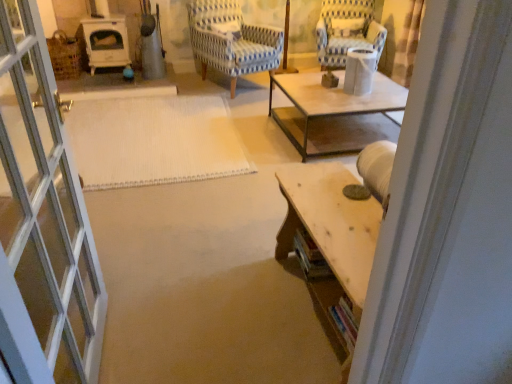
The image size is (512, 384). What are the coordinates of `white woven mat at center` in the screenshot? It's located at (154, 141).

Find the location of `blue and white striped fabric chair at upper right, the first chair from the right`. blue and white striped fabric chair at upper right, the first chair from the right is located at coordinates (347, 31).

The image size is (512, 384). Describe the element at coordinates (331, 222) in the screenshot. I see `wooden table at lower right` at that location.

You are a GUI agent. You are given a task and a screenshot of the screen. Output one action in this format:
    pyautogui.click(x=<x>, y=<y>)
    Task: Click on the white woven mat at center
    This screenshot has width=512, height=384.
    Given the screenshot: What is the action you would take?
    pyautogui.click(x=154, y=141)

Is wooden table at lower right touching blue and white striped fabric chair at upper right, the 2th chair when ordered from left to right?

wooden table at lower right is not next to blue and white striped fabric chair at upper right, the 2th chair when ordered from left to right, and they're not touching.

Between wooden table at lower right and blue and white striped fabric chair at upper right, the 2th chair when ordered from left to right, which one has smaller width?

wooden table at lower right.

What's the angular difference between wooden table at lower right and blue and white striped fabric chair at upper right, the first chair from the right,'s facing directions?

They differ by 67.4 degrees in their facing directions.

Is blue and white striped fabric chair at upper right, the first chair from the right, at the back of wooden table at lower right?

That's not correct — wooden table at lower right is not looking away from blue and white striped fabric chair at upper right, the first chair from the right.

Can you confirm if white woven mat at center is bigger than blue striped fabric chair at center, acting as the 2th chair starting from the right?

No, white woven mat at center is not bigger than blue striped fabric chair at center, acting as the 2th chair starting from the right.

Which is more to the right, white woven mat at center or blue striped fabric chair at center, acting as the 2th chair starting from the right?

From the viewer's perspective, blue striped fabric chair at center, acting as the 2th chair starting from the right, appears more on the right side.

In order to click on mat located below the blue striped fabric chair at center, which ranks as the first chair in left-to-right order (from the image's perspective) in this screenshot , I will do `click(154, 141)`.

Which object is thinner, white woven mat at center or blue striped fabric chair at center, which ranks as the first chair in left-to-right order?

Thinner between the two is blue striped fabric chair at center, which ranks as the first chair in left-to-right order.

Is the position of blue and white striped fabric chair at upper right, the first chair from the right, more distant than that of white woven mat at center?

Yes, blue and white striped fabric chair at upper right, the first chair from the right, is further from the viewer.

Considering the relative sizes of blue and white striped fabric chair at upper right, the first chair from the right, and white woven mat at center in the image provided, is blue and white striped fabric chair at upper right, the first chair from the right, thinner than white woven mat at center?

Indeed, blue and white striped fabric chair at upper right, the first chair from the right, has a lesser width compared to white woven mat at center.

Is blue and white striped fabric chair at upper right, the 2th chair when ordered from left to right, oriented away from white woven mat at center?

No, blue and white striped fabric chair at upper right, the 2th chair when ordered from left to right, is not facing away from white woven mat at center.

How many degrees apart are the facing directions of wooden table at lower right and blue striped fabric chair at center, acting as the 2th chair starting from the right?

There is a 109-degree angle between the facing directions of wooden table at lower right and blue striped fabric chair at center, acting as the 2th chair starting from the right.

Between wooden table at lower right and blue striped fabric chair at center, acting as the 2th chair starting from the right, which one has larger width?

Wider between the two is blue striped fabric chair at center, acting as the 2th chair starting from the right.

Can you confirm if wooden table at lower right is positioned to the left of blue striped fabric chair at center, which ranks as the first chair in left-to-right order?

No.

Which object is more forward, blue and white striped fabric chair at upper right, the 2th chair when ordered from left to right, or wooden table at lower right?

wooden table at lower right.

In the scene shown: Which point is more forward, (359,19) or (341,216)?

The point (341,216) is closer to the camera.

Is blue and white striped fabric chair at upper right, the first chair from the right, aimed at wooden table at lower right?

Yes, blue and white striped fabric chair at upper right, the first chair from the right, is facing wooden table at lower right.

Does blue and white striped fabric chair at upper right, the first chair from the right, have a lesser width compared to blue striped fabric chair at center, which ranks as the first chair in left-to-right order?

Yes, blue and white striped fabric chair at upper right, the first chair from the right, is thinner than blue striped fabric chair at center, which ranks as the first chair in left-to-right order.

From the image's perspective, is blue and white striped fabric chair at upper right, the first chair from the right, positioned above or below blue striped fabric chair at center, which ranks as the first chair in left-to-right order?

Based on their image positions, blue and white striped fabric chair at upper right, the first chair from the right, is located above blue striped fabric chair at center, which ranks as the first chair in left-to-right order.

Is blue and white striped fabric chair at upper right, the first chair from the right, facing away from blue striped fabric chair at center, acting as the 2th chair starting from the right?

No, blue and white striped fabric chair at upper right, the first chair from the right, is not facing away from blue striped fabric chair at center, acting as the 2th chair starting from the right.

In order to click on chair above the blue striped fabric chair at center, acting as the 2th chair starting from the right (from the image's perspective) in this screenshot , I will do `click(347, 31)`.

Is white woven mat at center to the left of wooden table at lower right from the viewer's perspective?

Yes.

From the image's perspective, which is above, white woven mat at center or wooden table at lower right?

white woven mat at center, from the image's perspective.

Relative to wooden table at lower right, is white woven mat at center in front or behind?

In the image, white woven mat at center appears behind wooden table at lower right.

Identify the location of table directly beneath the blue and white striped fabric chair at upper right, the first chair from the right (from a real-world perspective). This screenshot has width=512, height=384. (331, 222).

Locate an element on the screen. The image size is (512, 384). mat that is on the left side of blue striped fabric chair at center, which ranks as the first chair in left-to-right order is located at coordinates (154, 141).

Estimate the real-world distances between objects in this image. Which object is further from blue and white striped fabric chair at upper right, the first chair from the right, wooden table at lower right or blue striped fabric chair at center, acting as the 2th chair starting from the right?

wooden table at lower right is positioned further to the anchor blue and white striped fabric chair at upper right, the first chair from the right.

Estimate the real-world distances between objects in this image. Which object is closer to white woven mat at center, wooden table at lower right or blue and white striped fabric chair at upper right, the first chair from the right?

Based on the image, wooden table at lower right appears to be nearer to white woven mat at center.

Based on the photo, which object lies further to the anchor point white woven mat at center, blue and white striped fabric chair at upper right, the first chair from the right, or blue striped fabric chair at center, which ranks as the first chair in left-to-right order?

Based on the image, blue and white striped fabric chair at upper right, the first chair from the right, appears to be further to white woven mat at center.

Which object lies further to the anchor point wooden table at lower right, white woven mat at center or blue striped fabric chair at center, acting as the 2th chair starting from the right?

blue striped fabric chair at center, acting as the 2th chair starting from the right.

From the image, which object appears to be farther from blue striped fabric chair at center, acting as the 2th chair starting from the right, blue and white striped fabric chair at upper right, the 2th chair when ordered from left to right, or white woven mat at center?

white woven mat at center lies further to blue striped fabric chair at center, acting as the 2th chair starting from the right, than the other object.

Which object lies further to the anchor point blue striped fabric chair at center, which ranks as the first chair in left-to-right order, white woven mat at center or blue and white striped fabric chair at upper right, the first chair from the right?

white woven mat at center lies further to blue striped fabric chair at center, which ranks as the first chair in left-to-right order, than the other object.

Based on their spatial positions, is white woven mat at center or blue striped fabric chair at center, which ranks as the first chair in left-to-right order, closer to blue and white striped fabric chair at upper right, the first chair from the right?

blue striped fabric chair at center, which ranks as the first chair in left-to-right order.

Considering their positions, is wooden table at lower right positioned closer to blue striped fabric chair at center, acting as the 2th chair starting from the right, than blue and white striped fabric chair at upper right, the 2th chair when ordered from left to right?

Based on the image, blue and white striped fabric chair at upper right, the 2th chair when ordered from left to right, appears to be nearer to blue striped fabric chair at center, acting as the 2th chair starting from the right.

Identify the location of mat between wooden table at lower right and blue and white striped fabric chair at upper right, the first chair from the right, from front to back. This screenshot has height=384, width=512. (154, 141).

The width and height of the screenshot is (512, 384). Identify the location of mat between wooden table at lower right and blue striped fabric chair at center, acting as the 2th chair starting from the right, along the z-axis. (154, 141).

Where is `chair located between white woven mat at center and blue and white striped fabric chair at upper right, the 2th chair when ordered from left to right, in the left-right direction`? The height and width of the screenshot is (384, 512). chair located between white woven mat at center and blue and white striped fabric chair at upper right, the 2th chair when ordered from left to right, in the left-right direction is located at coordinates (232, 41).

This screenshot has height=384, width=512. I want to click on chair between wooden table at lower right and blue and white striped fabric chair at upper right, the 2th chair when ordered from left to right, from front to back, so click(232, 41).